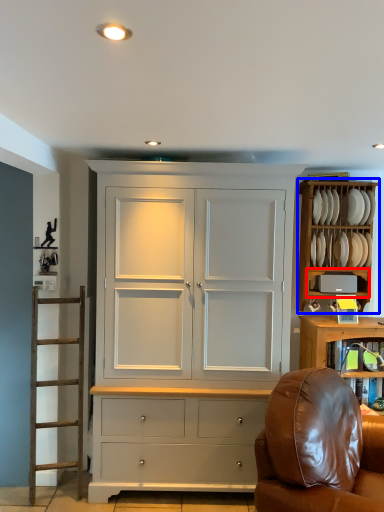
Question: Which object is closer to the camera taking this photo, shelf (highlighted by a red box) or cabinetry (highlighted by a blue box)?

Choices:
 (A) shelf
 (B) cabinetry

Answer: (A)